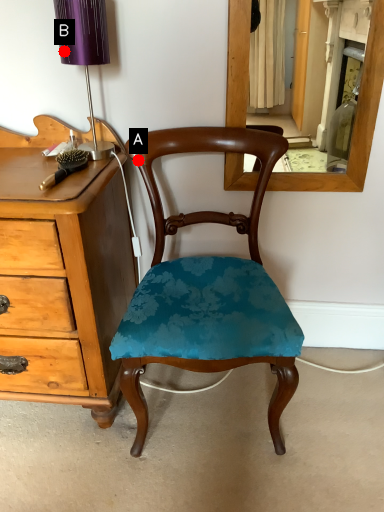
Question: Two points are circled on the image, labeled by A and B beside each circle. Which of the following is the farthest from the observer?

Choices:
 (A) A is further
 (B) B is further

Answer: (A)